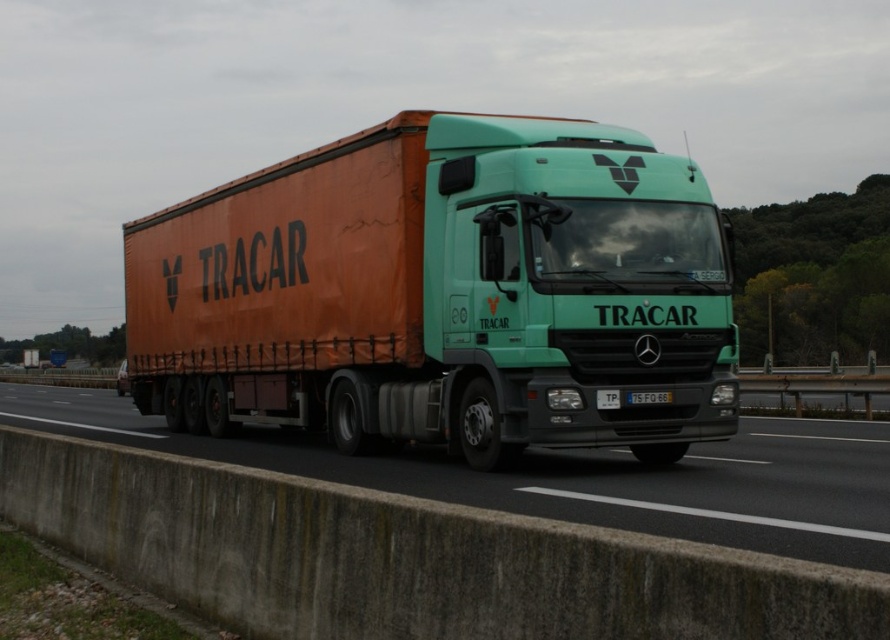
Which is more to the right, concrete barrier at lower center or white plastic license plate at center?

white plastic license plate at center is more to the right.

Can you confirm if concrete barrier at lower center is positioned below white plastic license plate at center?

Correct, concrete barrier at lower center is located below white plastic license plate at center.

Which is in front, point (846, 480) or point (668, 397)?

Positioned in front is point (846, 480).

Image resolution: width=890 pixels, height=640 pixels. Find the location of `concrete barrier at lower center`. concrete barrier at lower center is located at coordinates (572, 476).

Which of these two, orange fabric trailer truck at center or white plastic license plate at center, stands shorter?

white plastic license plate at center

Who is lower down, orange fabric trailer truck at center or white plastic license plate at center?

white plastic license plate at center

Does point (350, 253) come behind point (636, 397)?

Yes, it is behind point (636, 397).

Find the location of a particular element. orange fabric trailer truck at center is located at coordinates (445, 292).

How distant is orange fabric trailer truck at center from concrete barrier at lower center?

orange fabric trailer truck at center is 2.37 meters away from concrete barrier at lower center.

Who is taller, orange fabric trailer truck at center or concrete barrier at lower center?

Standing taller between the two is orange fabric trailer truck at center.

Locate an element on the screen. orange fabric trailer truck at center is located at coordinates (445, 292).